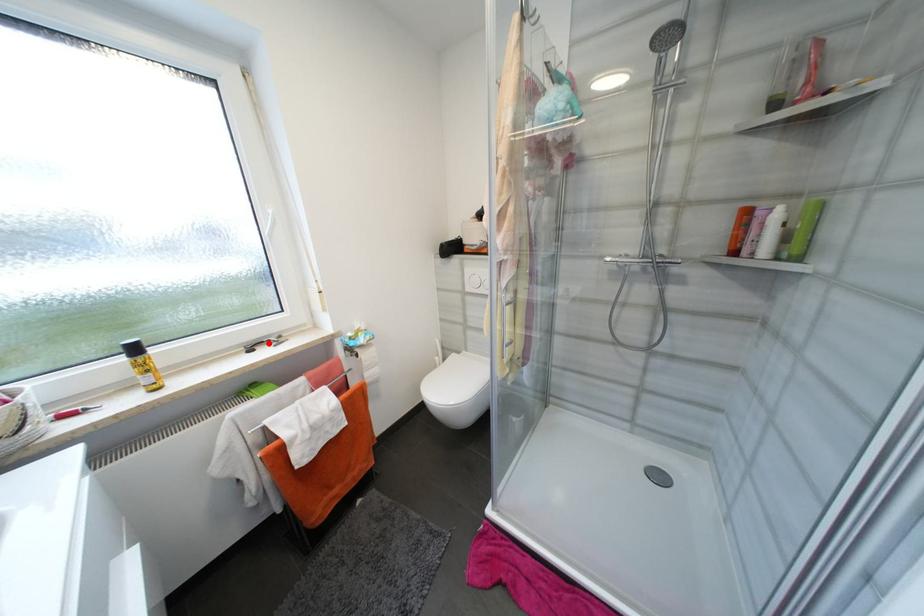
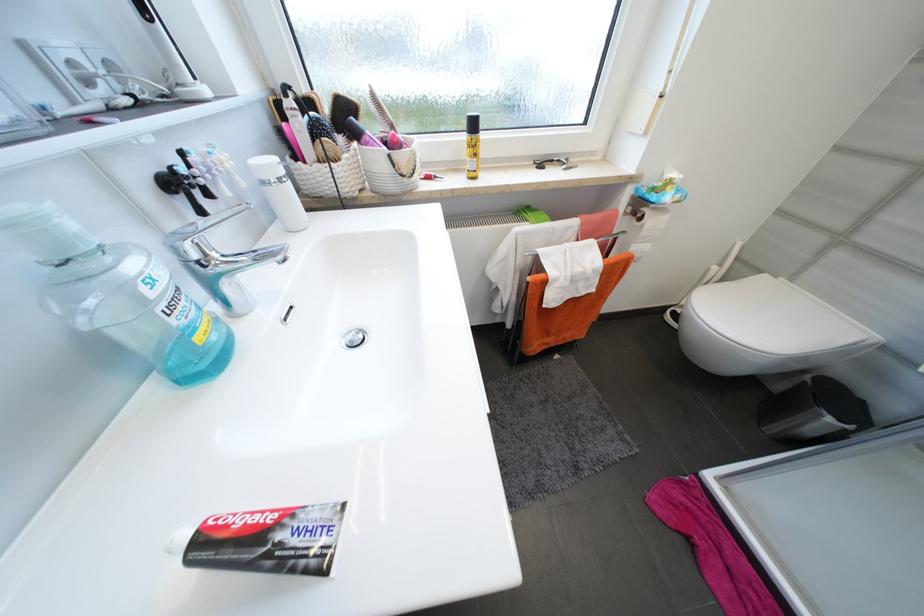
Where in the second image is the point corresponding to the highlighted location from the first image?

(558, 161)